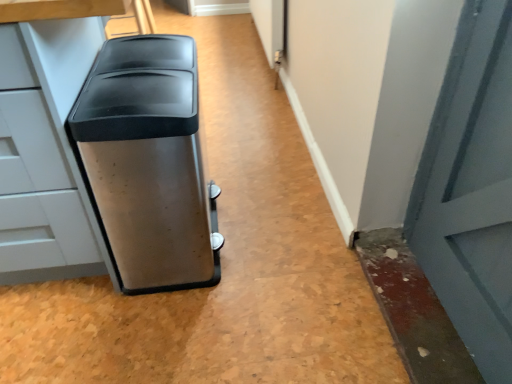
Locate an element on the screen. vacant space to the right of stainless steel trash can at center is located at coordinates (274, 233).